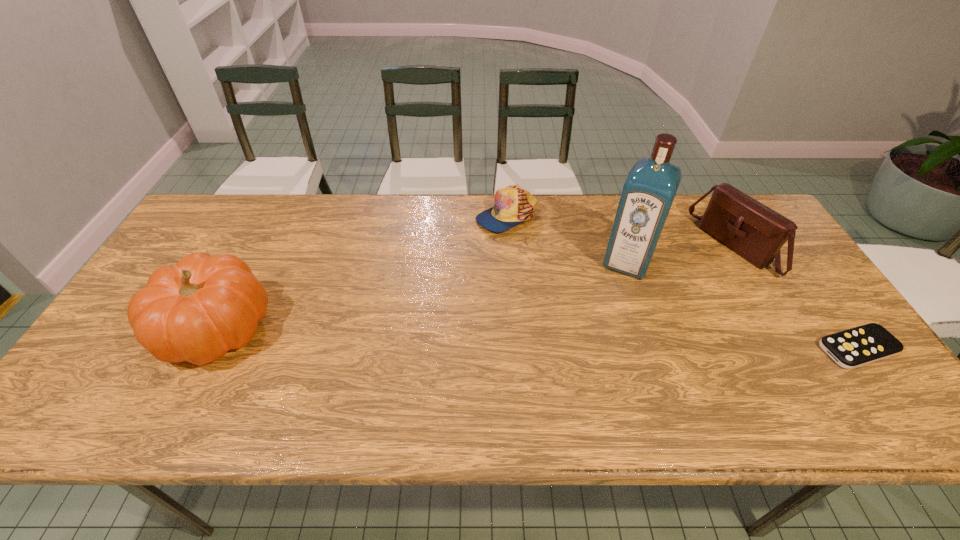
The height and width of the screenshot is (540, 960). Find the location of `the second closest object to the cap`. the second closest object to the cap is located at coordinates (751, 229).

Where is `object that can be found as the fourth closest to the liquor`? Image resolution: width=960 pixels, height=540 pixels. object that can be found as the fourth closest to the liquor is located at coordinates (197, 310).

Find the location of a particular element. Image resolution: width=960 pixels, height=540 pixels. free point that satisfies the following two spatial constraints: 1. on the back side of the fourth shortest object; 2. on the right side of the liquor is located at coordinates (251, 262).

The width and height of the screenshot is (960, 540). I want to click on free space that satisfies the following two spatial constraints: 1. on the front side of the fourth object from right to left; 2. on the left side of the shortest object, so click(x=516, y=348).

Where is `vacant space that satisfies the following two spatial constraints: 1. on the front side of the fourth object from right to left; 2. on the right side of the shoulder bag`? vacant space that satisfies the following two spatial constraints: 1. on the front side of the fourth object from right to left; 2. on the right side of the shoulder bag is located at coordinates (509, 247).

Identify the location of blank area in the image that satisfies the following two spatial constraints: 1. on the back side of the tallest object; 2. on the left side of the third tallest object. 622,247.

Identify the location of vacant space that satisfies the following two spatial constraints: 1. on the back side of the second shortest object; 2. on the left side of the leftmost object. The image size is (960, 540). (275, 216).